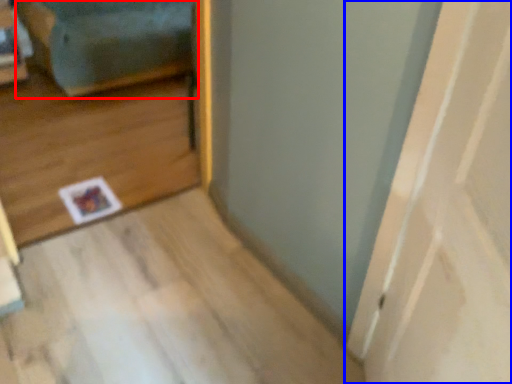
Question: Which object is further to the camera taking this photo, couch (highlighted by a red box) or door (highlighted by a blue box)?

Choices:
 (A) couch
 (B) door

Answer: (A)